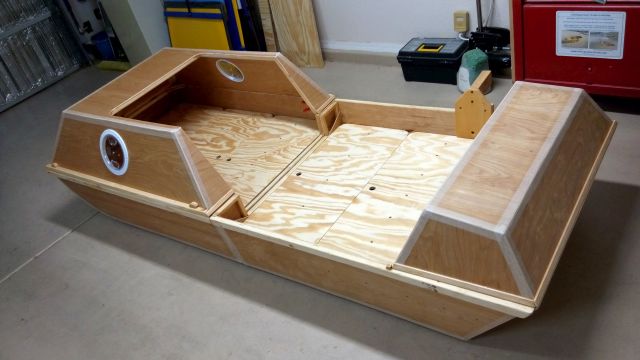
The width and height of the screenshot is (640, 360). Identify the location of wall. (392, 38).